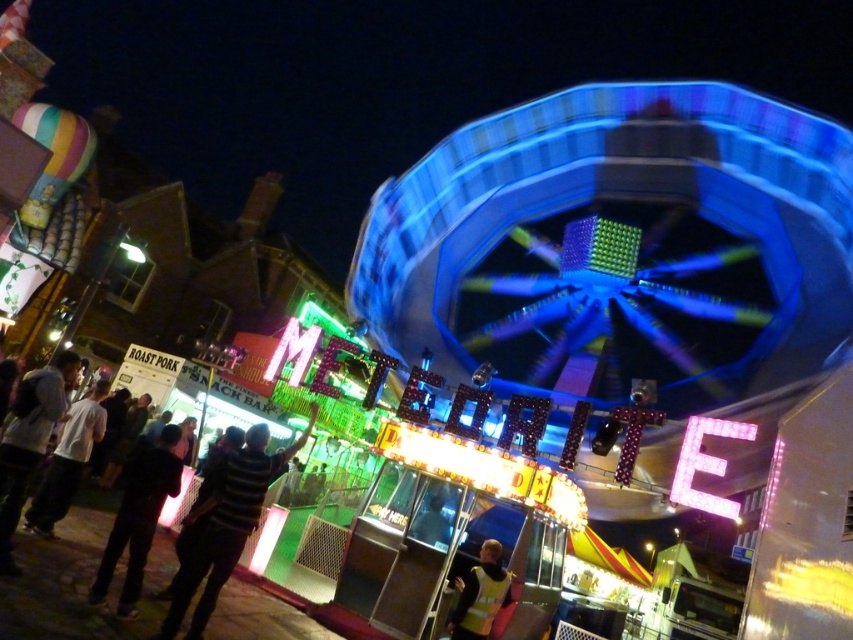
The image size is (853, 640). I want to click on black fabric jacket at lower left, so click(x=138, y=518).

Who is taller, black fabric jacket at lower left or metallic silver helmet at center?

With more height is black fabric jacket at lower left.

Which is in front, point (158, 468) or point (425, 508)?

Point (158, 468) is in front.

Image resolution: width=853 pixels, height=640 pixels. What are the coordinates of `black fabric jacket at lower left` in the screenshot? It's located at (138, 518).

Which is more to the right, dark blue jeans at lower left or yellow reflective vest at center?

Positioned to the right is yellow reflective vest at center.

Does dark blue jeans at lower left appear on the right side of yellow reflective vest at center?

In fact, dark blue jeans at lower left is to the left of yellow reflective vest at center.

Is point (20, 566) in front of point (463, 608)?

Yes, it is in front of point (463, 608).

The width and height of the screenshot is (853, 640). Identify the location of dark blue jeans at lower left. (67, 588).

Can you confirm if blue metallic ferris wheel at upper center is wider than white matte shirt at lower left?

Correct, the width of blue metallic ferris wheel at upper center exceeds that of white matte shirt at lower left.

Image resolution: width=853 pixels, height=640 pixels. Describe the element at coordinates (619, 244) in the screenshot. I see `blue metallic ferris wheel at upper center` at that location.

Who is more distant from viewer, (820, 227) or (38, 504)?

Positioned behind is point (820, 227).

Locate an element on the screen. This screenshot has height=640, width=853. blue metallic ferris wheel at upper center is located at coordinates (619, 244).